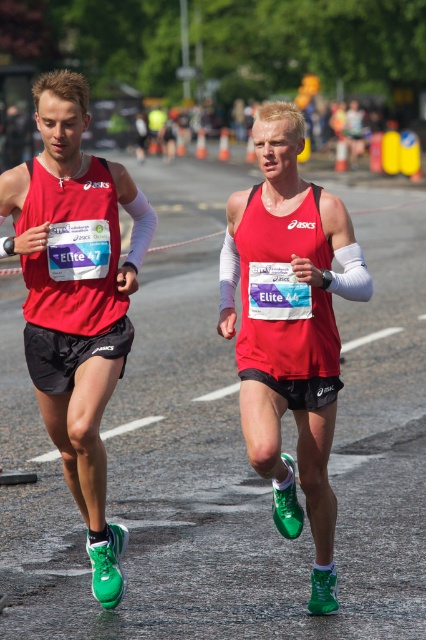
Is point (17, 230) behind point (247, 212)?

Yes, it is.

Between point (94, 308) and point (265, 429), which one is positioned in front?

Point (265, 429)

Where is `matte red tank top at left`? The image size is (426, 640). matte red tank top at left is located at coordinates (77, 298).

Identify the location of matte red tank top at left. (77, 298).